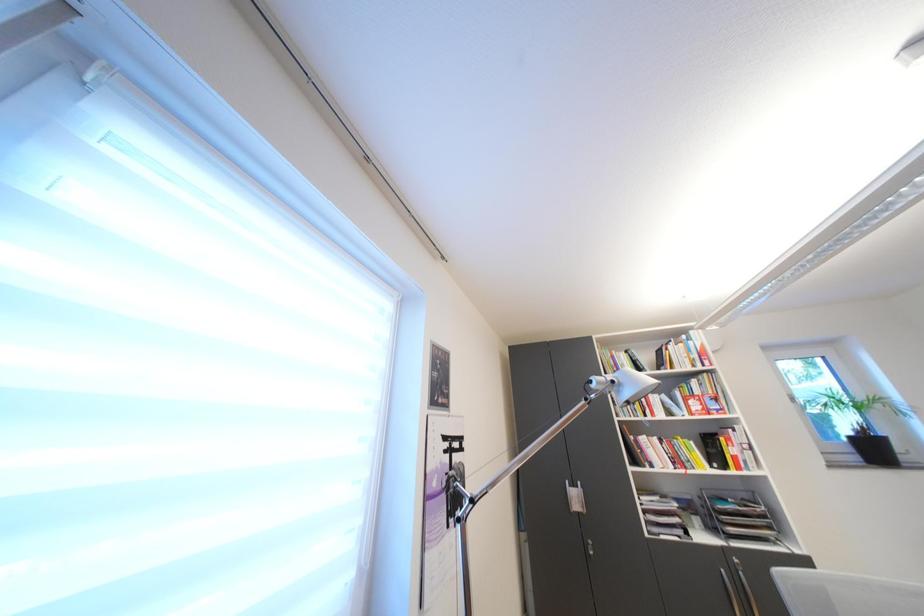
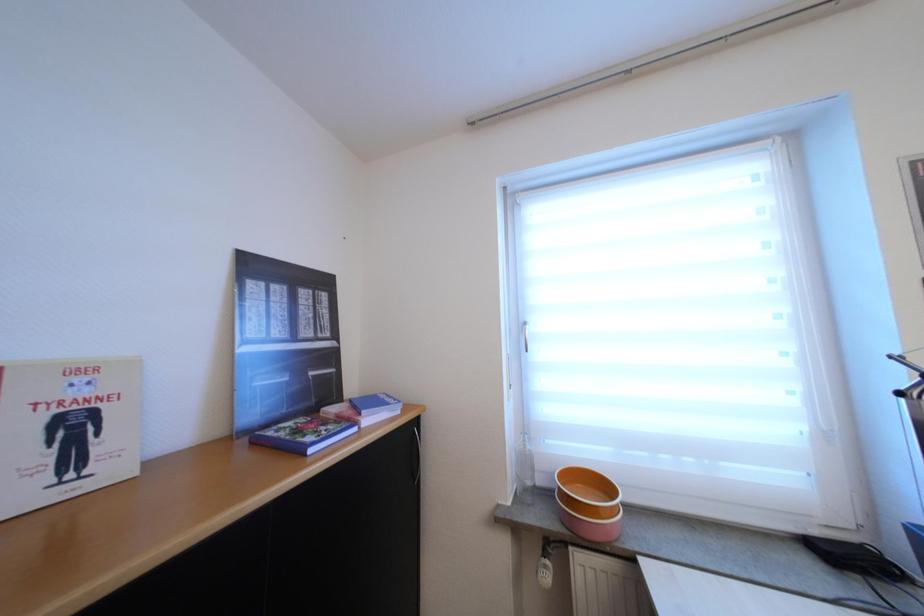
Question: The camera is either moving clockwise (left) or counter-clockwise (right) around the object. The first image is from the beginning of the video and the second image is from the end. Is the camera moving left or right when shooting the video?

Choices:
 (A) Left
 (B) Right

Answer: (B)